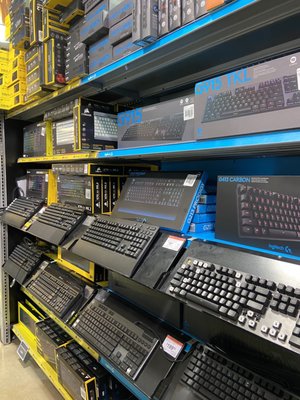
Find the location of a particular element. The image size is (300, 400). gray keyboards is located at coordinates (51, 233), (8, 215), (113, 262).